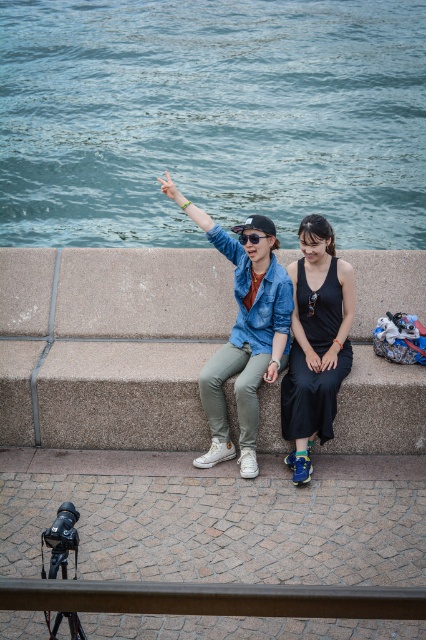
Which of these two, black matte dress at center or black matte sunglasses at upper center, stands shorter?

black matte sunglasses at upper center

Can you confirm if black matte dress at center is shorter than black matte sunglasses at upper center?

No.

Between point (336, 330) and point (247, 236), which one is positioned behind?

Positioned behind is point (336, 330).

At what (x,y) coordinates should I click in order to perform the action: click on black matte dress at center. Please return your answer as a coordinate pair (x, y). Looking at the image, I should click on (316, 342).

Is blue water at upper center in front of black matte sunglasses at upper center?

No.

Does blue water at upper center have a lesser height compared to black matte sunglasses at upper center?

No, blue water at upper center is not shorter than black matte sunglasses at upper center.

Does point (152, 113) lie behind point (241, 241)?

Yes.

Locate an element on the screen. blue water at upper center is located at coordinates (210, 118).

Does concrete ledge at center lie behind black matte dress at center?

Yes, it is.

Which is below, concrete ledge at center or black matte dress at center?

black matte dress at center is below.

Which is behind, point (97, 417) or point (290, 368)?

Point (97, 417)

The width and height of the screenshot is (426, 640). I want to click on concrete ledge at center, so click(x=109, y=344).